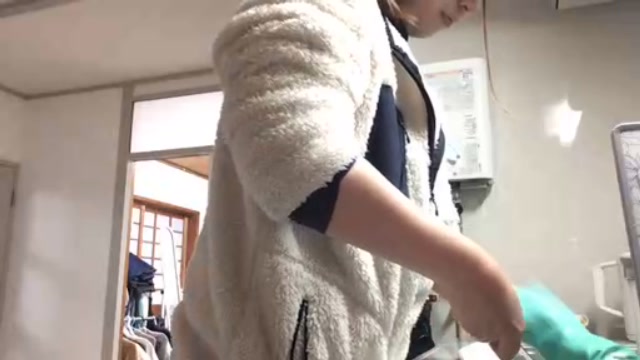
Find the location of a particular element. Image resolution: width=640 pixels, height=360 pixels. window pane is located at coordinates (152, 96), (200, 91), (204, 150), (150, 151), (140, 217), (137, 246), (166, 225), (150, 252).